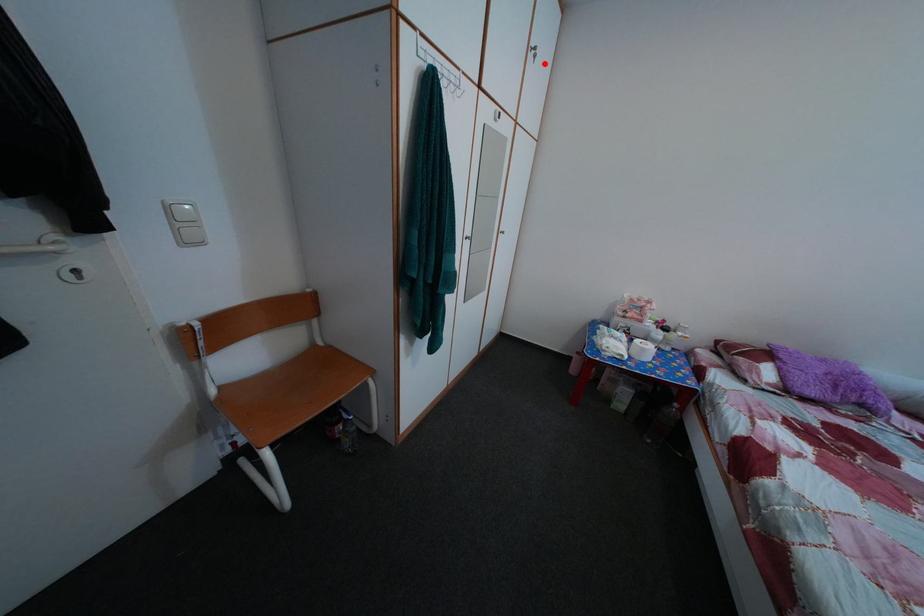
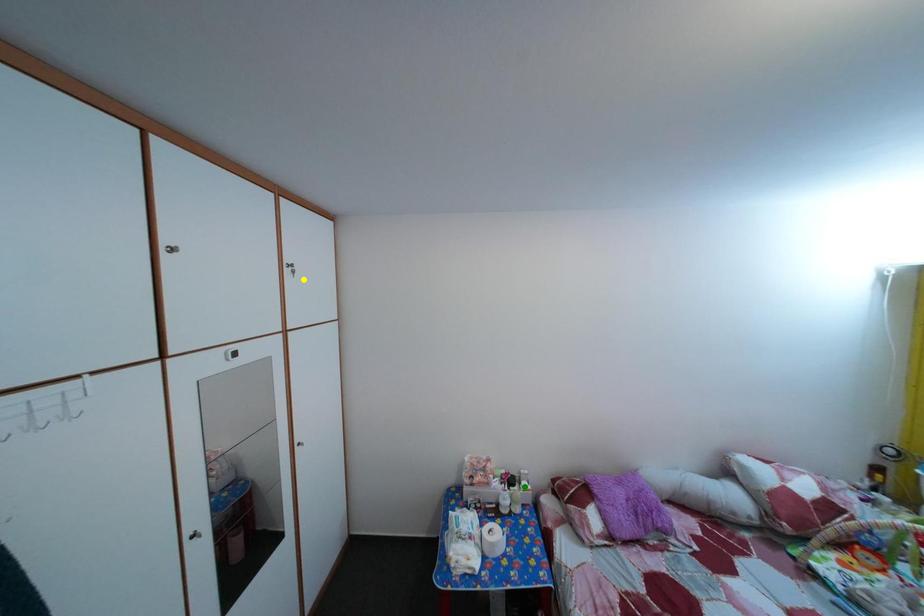
Question: I am providing you with two images of the same scene from different viewpoints. A red point is marked on the first image. You are given multiple points on the second image. Can you choose the point in image 2 that corresponds to the point in image 1?

Choices:
 (A) blue point
 (B) green point
 (C) yellow point

Answer: (C)